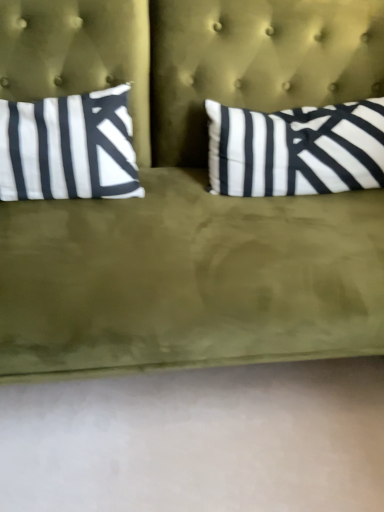
This screenshot has height=512, width=384. In order to click on olive green fabric studio couch at center in this screenshot , I will do `click(189, 277)`.

In order to face olive green fabric studio couch at center, should I rotate leftwards or rightwards?

A 2.654 degree turn to the right will do.

This screenshot has height=512, width=384. Describe the element at coordinates (189, 277) in the screenshot. I see `olive green fabric studio couch at center` at that location.

This screenshot has width=384, height=512. I want to click on olive green fabric studio couch at center, so click(x=189, y=277).